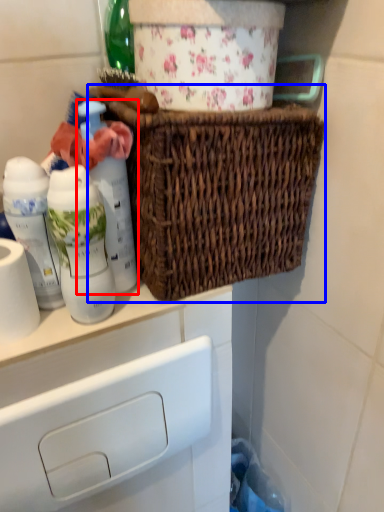
Question: Among these objects, which one is farthest to the camera, bottle (highlighted by a red box) or picnic basket (highlighted by a blue box)?

Choices:
 (A) bottle
 (B) picnic basket

Answer: (A)